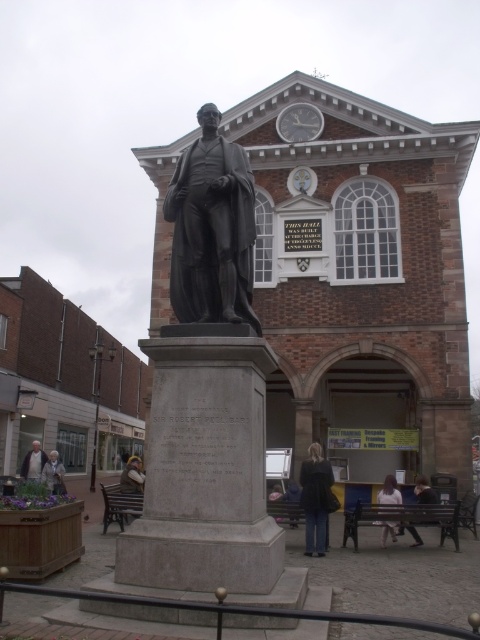
Question: Which object appears farthest from the camera in this image?

Choices:
 (A) black polished statue at center
 (B) brown leather bag at lower left
 (C) light brown leather jacket at lower left
 (D) matte bronze statue at center

Answer: (C)

Question: Where is brown leather bag at lower left located in relation to matte bronze statue at center in the image?

Choices:
 (A) above
 (B) below

Answer: (B)

Question: Where is light beige fabric skirt at lower center located in relation to light brown leather jacket at lower left in the image?

Choices:
 (A) below
 (B) above

Answer: (B)

Question: Which point is closer to the camera taking this photo?

Choices:
 (A) pyautogui.click(x=381, y=497)
 (B) pyautogui.click(x=242, y=173)

Answer: (B)

Question: Estimate the real-world distances between objects in this image. Which object is farther from the black polished statue at center?

Choices:
 (A) dark blue jeans at lower center
 (B) light beige fabric skirt at lower center

Answer: (B)

Question: Is black polished statue at center smaller than dark blue jeans at lower center?

Choices:
 (A) no
 (B) yes

Answer: (A)